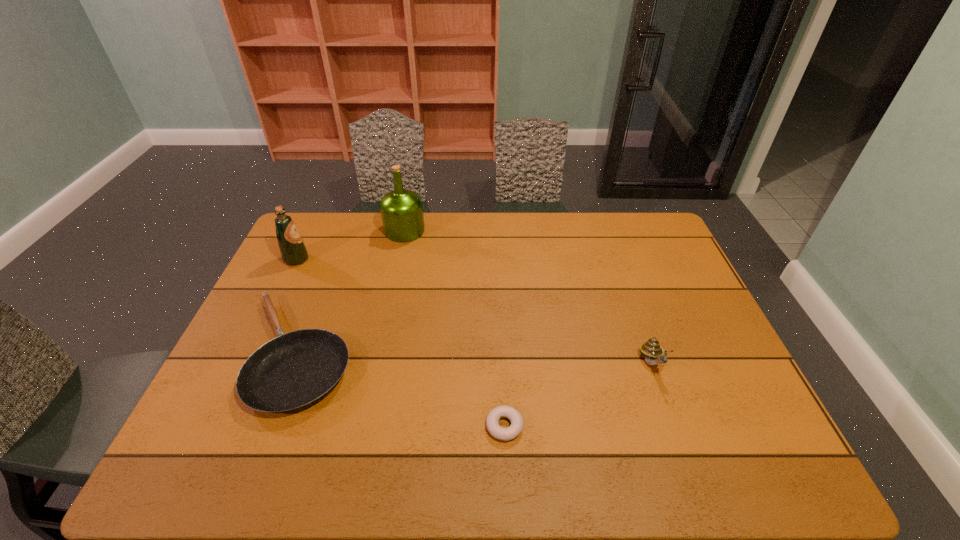
This screenshot has width=960, height=540. In the image, there is a desktop. What are the coordinates of `vacant space at the left edge` in the screenshot? It's located at (313, 261).

This screenshot has height=540, width=960. Identify the location of free location at the right edge. (671, 363).

At what (x,y) coordinates should I click in order to perform the action: click on vacant space at the far right corner. Please return your answer as a coordinate pair (x, y). Image resolution: width=960 pixels, height=540 pixels. Looking at the image, I should click on (660, 235).

In order to click on empty space that is in between the shorter olive oil and the fourth object from left to right in this screenshot , I will do `click(400, 343)`.

Find the location of a particular element. The image size is (960, 540). free space that is in between the doughnut and the rightmost object is located at coordinates (578, 395).

I want to click on vacant space in between the farthest object and the frying pan, so click(351, 292).

The height and width of the screenshot is (540, 960). In order to click on vacant space in between the rightmost object and the right olive oil in this screenshot , I will do `click(528, 296)`.

At what (x,y) coordinates should I click in order to perform the action: click on vacant space in between the right olive oil and the rightmost object. Please return your answer as a coordinate pair (x, y). This screenshot has width=960, height=540. Looking at the image, I should click on (528, 296).

Identify the location of vacant space that is in between the right olive oil and the nearer olive oil. (350, 245).

The height and width of the screenshot is (540, 960). Find the location of `vacant region between the fourth tallest object and the fourth object from left to right`. vacant region between the fourth tallest object and the fourth object from left to right is located at coordinates (401, 389).